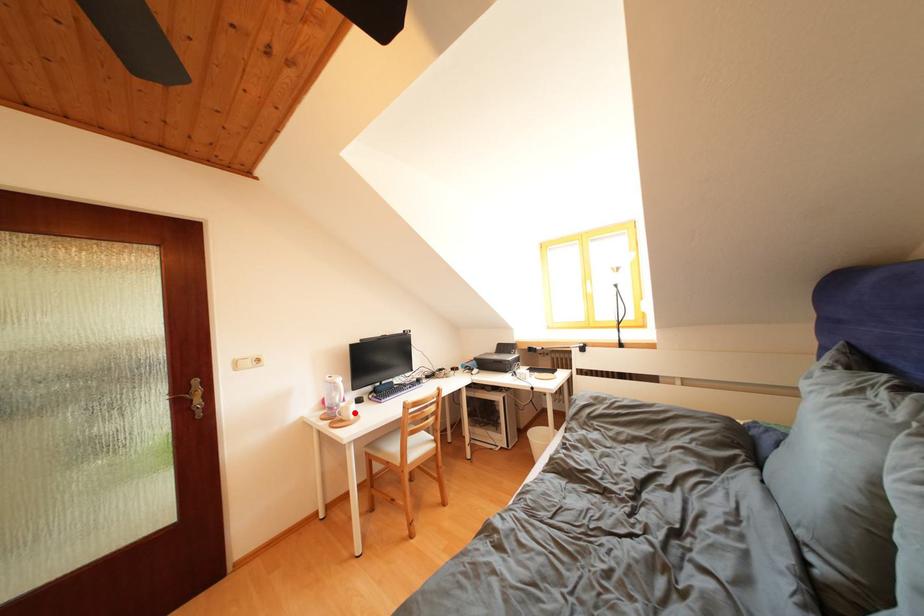
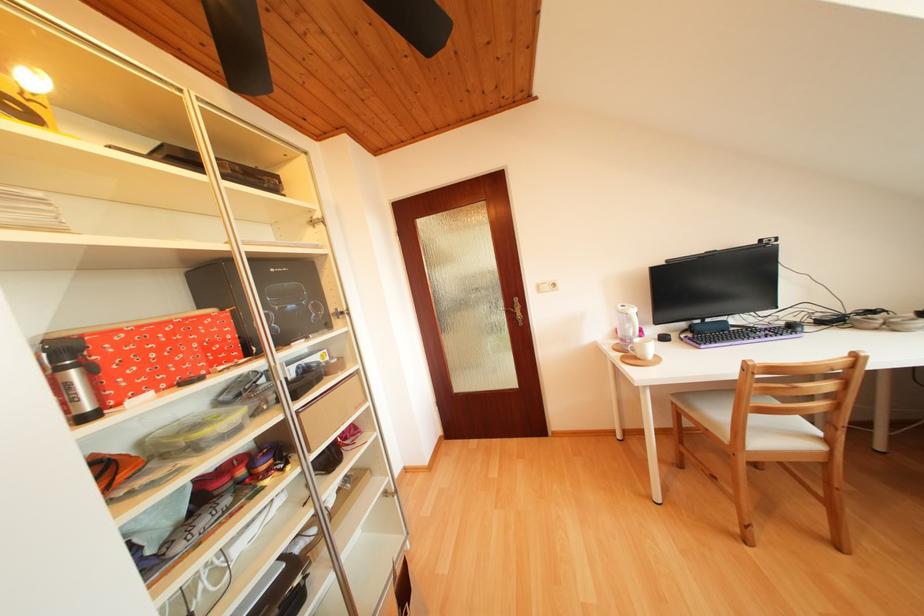
In the second image, find the point that corresponds to the highlighted location in the first image.

(650, 350)